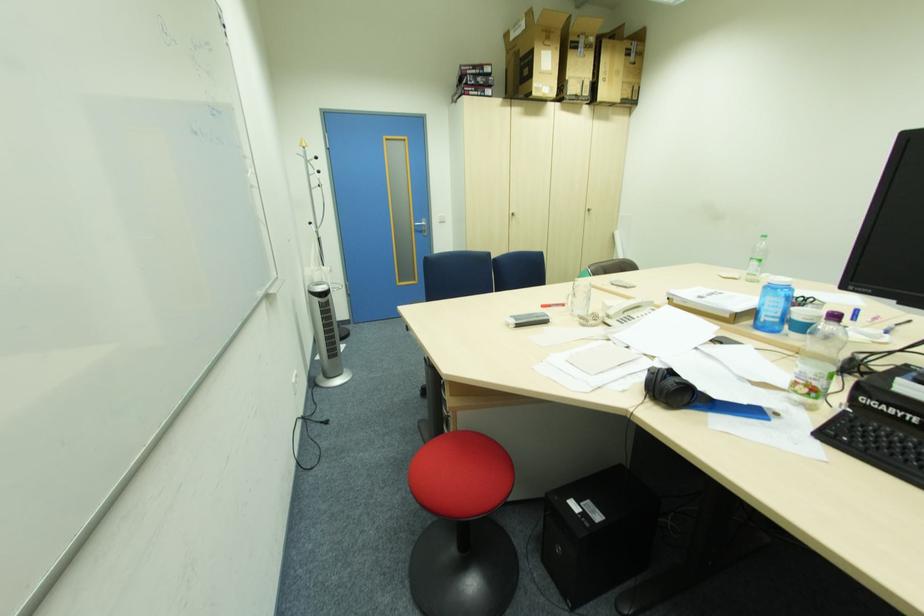
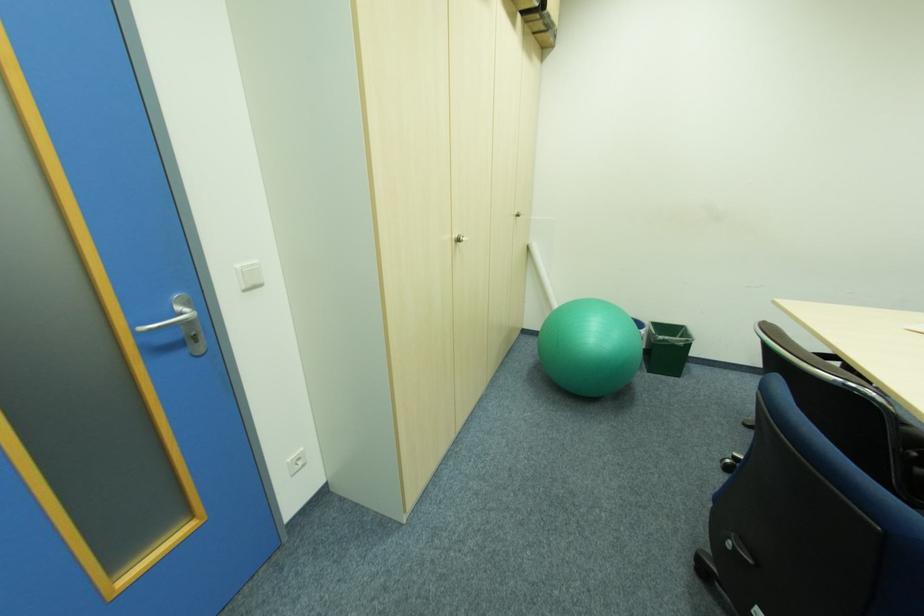
Find the pixel in the second image that matches point (430, 232) in the first image.

(200, 339)